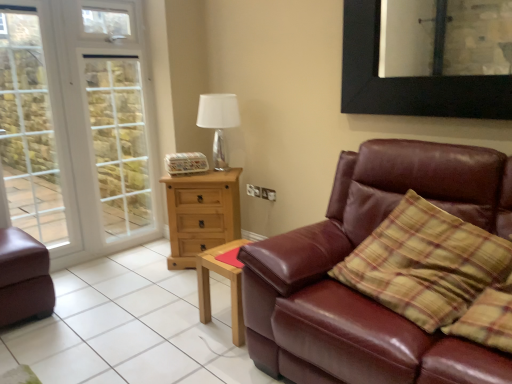
This screenshot has width=512, height=384. I want to click on free space in front of light wood rectangular table at center, so click(217, 357).